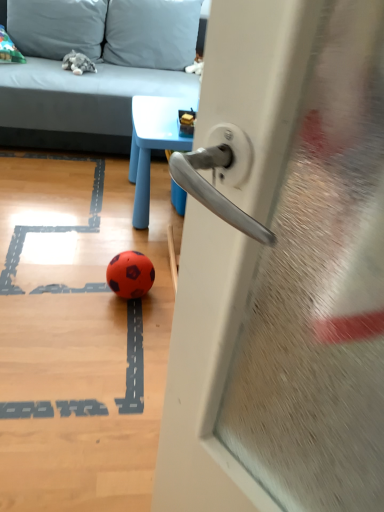
What do you see at coordinates (57, 27) in the screenshot? I see `soft gray pillow at upper left, acting as the second pillow starting from the right` at bounding box center [57, 27].

The width and height of the screenshot is (384, 512). Find the location of `soft gray pillow at upper left, arranged as the first pillow when viewed from the left`. soft gray pillow at upper left, arranged as the first pillow when viewed from the left is located at coordinates (57, 27).

I want to click on gray plush toy at upper left, so click(78, 63).

Describe the element at coordinates (78, 104) in the screenshot. I see `gray fabric couch at upper left` at that location.

At what (x,y) coordinates should I click in order to perform the action: click on soft gray pillow at upper left, arranged as the first pillow when viewed from the left. Please return your answer as a coordinate pair (x, y). The height and width of the screenshot is (512, 384). Looking at the image, I should click on (57, 27).

From a real-world perspective, is blue plastic table at upper center below soft gray pillow at upper left, acting as the second pillow starting from the right?

Indeed, from a real-world perspective, blue plastic table at upper center is positioned beneath soft gray pillow at upper left, acting as the second pillow starting from the right.

Is point (139, 179) farther from viewer compared to point (45, 8)?

No, it is not.

Considering the sizes of blue plastic table at upper center and soft gray pillow at upper left, arranged as the first pillow when viewed from the left, in the image, is blue plastic table at upper center bigger or smaller than soft gray pillow at upper left, arranged as the first pillow when viewed from the left,?

Clearly, blue plastic table at upper center is larger in size than soft gray pillow at upper left, arranged as the first pillow when viewed from the left.

Which object is further away from the camera, blue plastic table at upper center or soft gray pillow at upper left, arranged as the first pillow when viewed from the left?

Positioned behind is soft gray pillow at upper left, arranged as the first pillow when viewed from the left.

Which is in front, rubber soccer ball at center or gray fabric couch at upper left?

rubber soccer ball at center.

From the picture: How different are the orientations of rubber soccer ball at center and gray fabric couch at upper left in degrees?

rubber soccer ball at center and gray fabric couch at upper left are facing 88.5 degrees away from each other.

Can you confirm if rubber soccer ball at center is bigger than gray fabric couch at upper left?

No, rubber soccer ball at center is not bigger than gray fabric couch at upper left.

Is metallic silver handle at center in front of soft gray pillow at upper left, acting as the second pillow starting from the right?

Yes, metallic silver handle at center is closer to the viewer.

Is soft gray pillow at upper left, arranged as the first pillow when viewed from the left, at the back of metallic silver handle at center?

No.

Is metallic silver handle at center spatially inside soft gray pillow at upper left, acting as the second pillow starting from the right, or outside of it?

metallic silver handle at center is not enclosed by soft gray pillow at upper left, acting as the second pillow starting from the right.

Considering the positions of objects metallic silver handle at center and soft gray pillow at upper left, arranged as the first pillow when viewed from the left, in the image provided, who is more to the right, metallic silver handle at center or soft gray pillow at upper left, arranged as the first pillow when viewed from the left,?

metallic silver handle at center is more to the right.

Can you confirm if gray fabric couch at upper left is wider than blue plastic table at upper center?

Indeed, gray fabric couch at upper left has a greater width compared to blue plastic table at upper center.

What's the angular difference between gray fabric couch at upper left and blue plastic table at upper center's facing directions?

There is a 86.1-degree angle between the facing directions of gray fabric couch at upper left and blue plastic table at upper center.

In terms of height, does gray fabric couch at upper left look taller or shorter compared to blue plastic table at upper center?

Considering their sizes, gray fabric couch at upper left has more height than blue plastic table at upper center.

Find the location of `table on the right of gray fabric couch at upper left`. table on the right of gray fabric couch at upper left is located at coordinates (152, 144).

Considering the positions of point (190, 104) and point (81, 54), is point (190, 104) closer or farther from the camera than point (81, 54)?

Point (190, 104) is closer to the camera than point (81, 54).

Considering the relative positions of blue plastic table at upper center and gray plush toy at upper left in the image provided, is blue plastic table at upper center to the left of gray plush toy at upper left from the viewer's perspective?

In fact, blue plastic table at upper center is to the right of gray plush toy at upper left.

Is blue plastic table at upper center aimed at gray plush toy at upper left?

No, blue plastic table at upper center is not turned towards gray plush toy at upper left.

Is blue plastic table at upper center not within gray plush toy at upper left?

Yes, blue plastic table at upper center is outside of gray plush toy at upper left.

Are gray plush toy at upper left and soft gray pillow at upper left, acting as the second pillow starting from the right, beside each other?

No, gray plush toy at upper left is not touching soft gray pillow at upper left, acting as the second pillow starting from the right.

Looking at this image, is gray plush toy at upper left to the left of soft gray pillow at upper left, acting as the second pillow starting from the right, from the viewer's perspective?

No, gray plush toy at upper left is not to the left of soft gray pillow at upper left, acting as the second pillow starting from the right.

Considering the relative sizes of gray plush toy at upper left and soft gray pillow at upper left, arranged as the first pillow when viewed from the left, in the image provided, is gray plush toy at upper left taller than soft gray pillow at upper left, arranged as the first pillow when viewed from the left,?

No, gray plush toy at upper left is not taller than soft gray pillow at upper left, arranged as the first pillow when viewed from the left.

Is gray plush toy at upper left in front of or behind soft gray pillow at upper left, acting as the second pillow starting from the right, in the image?

Visually, gray plush toy at upper left is located in front of soft gray pillow at upper left, acting as the second pillow starting from the right.

Does soft gray pillow at upper left, arranged as the first pillow when viewed from the left, turn towards gray plush toy at upper left?

Yes, soft gray pillow at upper left, arranged as the first pillow when viewed from the left, is facing gray plush toy at upper left.

From a real-world perspective, who is located lower, soft gray pillow at upper left, arranged as the first pillow when viewed from the left, or gray plush toy at upper left?

From a 3D spatial view, gray plush toy at upper left is below.

Is soft gray pillow at upper left, arranged as the first pillow when viewed from the left, spatially inside gray plush toy at upper left, or outside of it?

The correct answer is: outside.

Considering the points (101, 48) and (73, 73), which point is in front, point (101, 48) or point (73, 73)?

The point (73, 73) is closer.

Find the location of a particular element. The height and width of the screenshot is (512, 384). table in front of the soft gray pillow at upper left, acting as the second pillow starting from the right is located at coordinates (152, 144).

Identify the location of ball that is below the gray fabric couch at upper left (from the image's perspective). The height and width of the screenshot is (512, 384). (130, 274).

Based on their spatial positions, is soft gray pillow at upper left, acting as the second pillow starting from the right, or gray plush toy at upper left closer to rubber soccer ball at center?

gray plush toy at upper left.

From the image, which object appears to be farther from rubber soccer ball at center, gray plush toy at upper left or blue plastic table at upper center?

The object further to rubber soccer ball at center is gray plush toy at upper left.

Which object lies nearer to the anchor point soft gray pillow at upper center, placed as the first pillow when sorted from right to left, gray plush toy at upper left or metallic silver handle at center?

Among the two, gray plush toy at upper left is located nearer to soft gray pillow at upper center, placed as the first pillow when sorted from right to left.

Looking at this image, based on their spatial positions, is gray fabric couch at upper left or soft gray pillow at upper left, arranged as the first pillow when viewed from the left, closer to soft gray pillow at upper center, which is the second pillow from left to right?

soft gray pillow at upper left, arranged as the first pillow when viewed from the left, lies closer to soft gray pillow at upper center, which is the second pillow from left to right, than the other object.

From the image, which object appears to be nearer to soft gray pillow at upper center, placed as the first pillow when sorted from right to left, soft gray pillow at upper left, acting as the second pillow starting from the right, or rubber soccer ball at center?

The object closer to soft gray pillow at upper center, placed as the first pillow when sorted from right to left, is soft gray pillow at upper left, acting as the second pillow starting from the right.

Based on their spatial positions, is rubber soccer ball at center or blue plastic table at upper center further from metallic silver handle at center?

blue plastic table at upper center lies further to metallic silver handle at center than the other object.

Considering their positions, is soft gray pillow at upper left, arranged as the first pillow when viewed from the left, positioned closer to soft gray pillow at upper center, which is the second pillow from left to right, than blue plastic table at upper center?

Among the two, soft gray pillow at upper left, arranged as the first pillow when viewed from the left, is located nearer to soft gray pillow at upper center, which is the second pillow from left to right.

When comparing their distances from rubber soccer ball at center, does soft gray pillow at upper left, acting as the second pillow starting from the right, or soft gray pillow at upper center, placed as the first pillow when sorted from right to left, seem further?

soft gray pillow at upper left, acting as the second pillow starting from the right, lies further to rubber soccer ball at center than the other object.

You are a GUI agent. You are given a task and a screenshot of the screen. Output one action in this format:
    pyautogui.click(x=<x>, y=<y>)
    Task: Click on the table between metallic silver handle at center and gray fabric couch at upper left from front to back
    
    Given the screenshot: What is the action you would take?
    pyautogui.click(x=152, y=144)

Find the location of a particular element. This screenshot has width=384, height=512. miniature between soft gray pillow at upper left, acting as the second pillow starting from the right, and rubber soccer ball at center in the up-down direction is located at coordinates (78, 63).

I want to click on ball located between metallic silver handle at center and gray plush toy at upper left in the depth direction, so click(130, 274).

Image resolution: width=384 pixels, height=512 pixels. I want to click on ball between metallic silver handle at center and gray fabric couch at upper left from front to back, so click(130, 274).